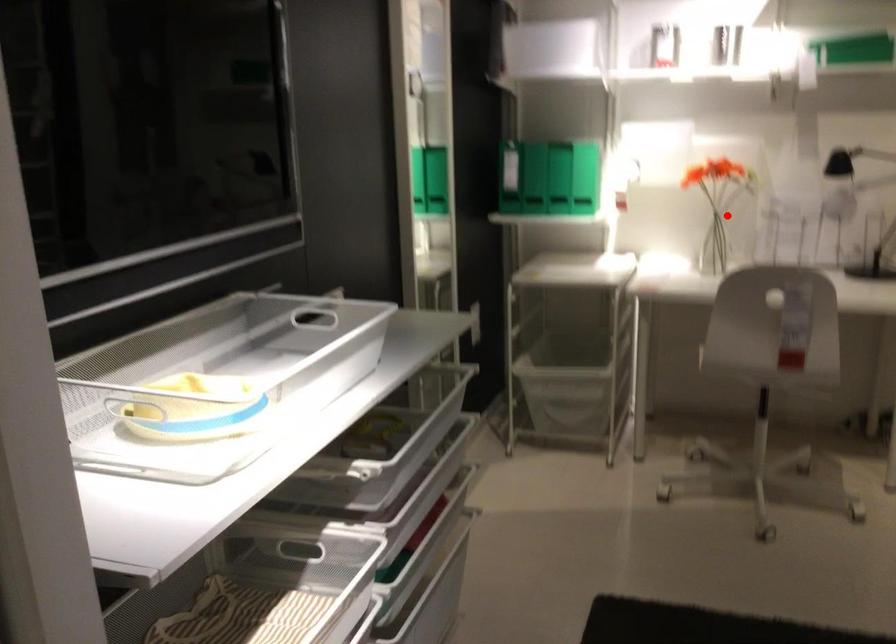
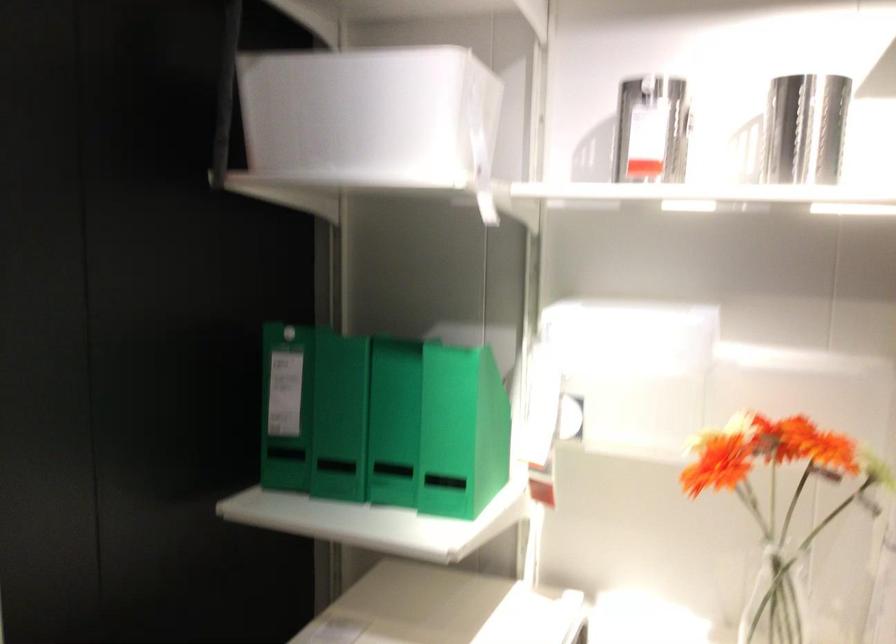
In the second image, find the point that corresponds to the highlighted location in the first image.

(777, 600)